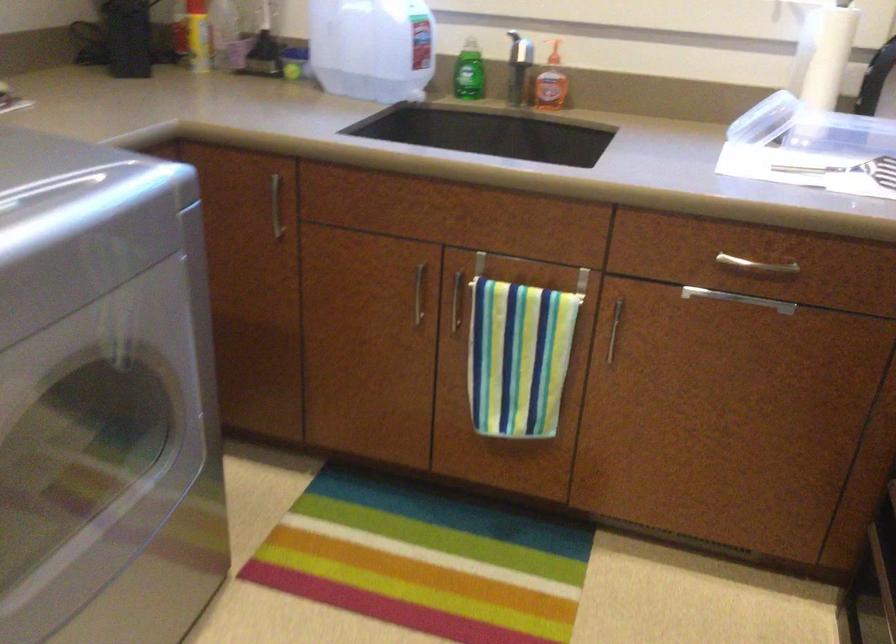
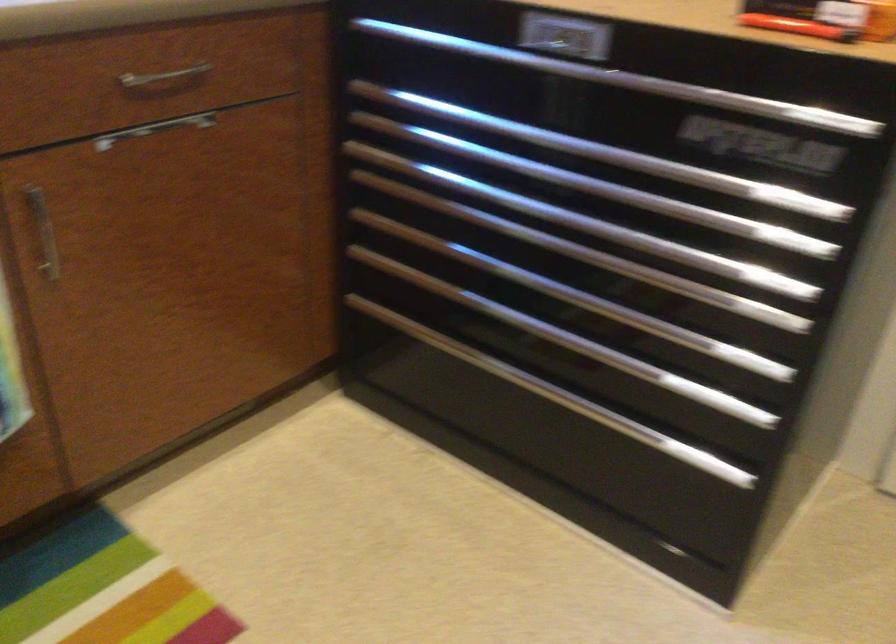
The images are taken continuously from a first-person perspective. In which direction is your viewpoint rotating?

The camera rotated toward right-down.